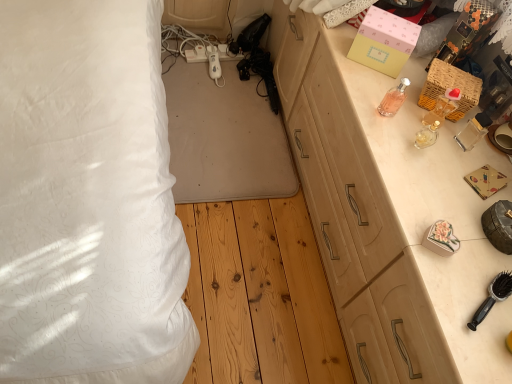
At what (x,y) coordinates should I click in order to perform the action: click on vacant area that lies in front of pink glass bottle at upper right, the first perfume in the left-to-right sequence. Please return your answer as a coordinate pair (x, y). The image size is (512, 384). Looking at the image, I should click on (389, 147).